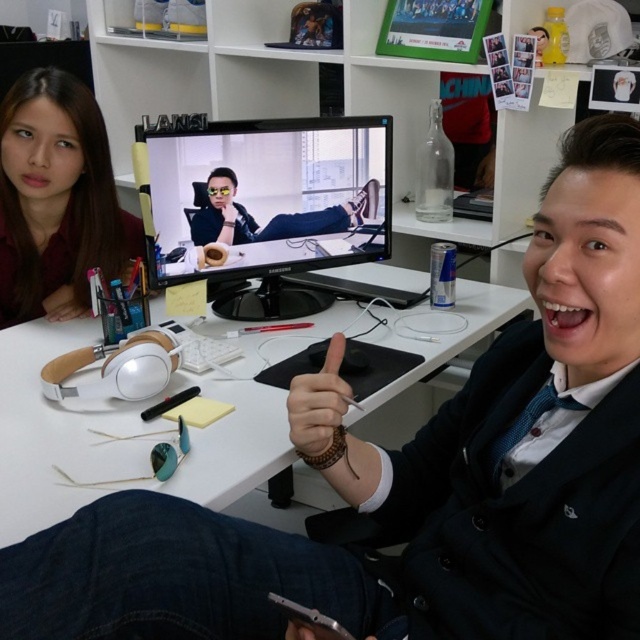
You are standing at the desk in the image. There are two points marked on the desk surface. The first point is at coordinate point[241,173] and the second is at point[65,97]. If you want to place a small object on the desk such that it is closer to you than the second point, which coordinate should you choose?

You should choose point[241,173] because it is in front of point[65,97], meaning it is closer to you.

You are an office assistant who needs to organize the desk items. The matte brown hair at upper left and the brown leather hand at center are blocking the computer monitor. Which object is closer to the left edge of the desk?

The matte brown hair at upper left is closer to the left edge of the desk because it is positioned on the left side of the brown leather hand at center.